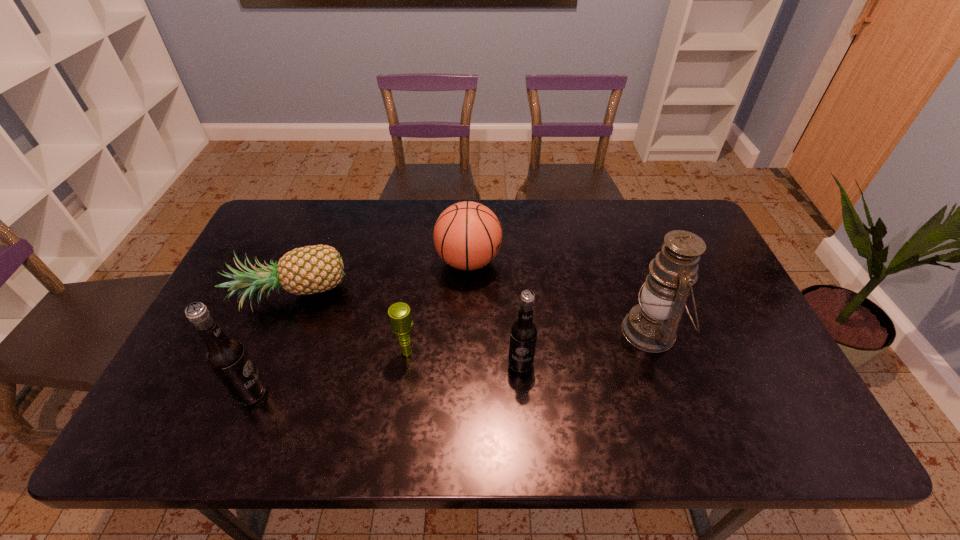
In order to click on vacant area that lies between the right root beer and the third object from left to right in this screenshot , I will do `click(464, 357)`.

At what (x,y) coordinates should I click in order to perform the action: click on free space between the oil lamp and the pineapple. Please return your answer as a coordinate pair (x, y). Looking at the image, I should click on (471, 315).

The height and width of the screenshot is (540, 960). What are the coordinates of `object identified as the closest to the third object from left to right` in the screenshot? It's located at (311, 269).

Image resolution: width=960 pixels, height=540 pixels. What are the coordinates of `the third closest object relative to the oil lamp` in the screenshot? It's located at (401, 322).

Locate an element on the screen. This screenshot has height=540, width=960. vacant space that satisfies the following two spatial constraints: 1. on the front side of the pineapple; 2. on the left side of the oil lamp is located at coordinates (277, 332).

Image resolution: width=960 pixels, height=540 pixels. Identify the location of free spot that satisfies the following two spatial constraints: 1. on the front side of the microphone; 2. on the label of the left root beer. (402, 393).

Identify the location of free space that satisfies the following two spatial constraints: 1. on the label of the third tallest object; 2. on the label of the left root beer. (522, 393).